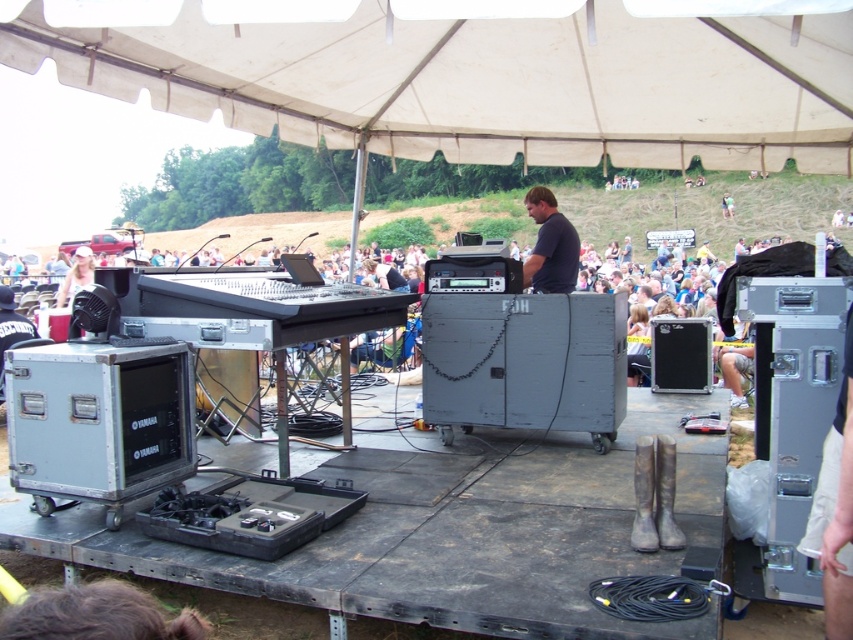
Can you confirm if white fabric canopy at upper center is wider than matte white baseball cap at upper left?

No.

Is point (722, 58) in front of point (71, 296)?

That is True.

Image resolution: width=853 pixels, height=640 pixels. I want to click on white fabric canopy at upper center, so click(x=486, y=83).

How distant is white fabric canopy at upper center from dark gray shirt at center?

white fabric canopy at upper center and dark gray shirt at center are 1.69 meters apart.

Describe the element at coordinates (486, 83) in the screenshot. I see `white fabric canopy at upper center` at that location.

Consider the image. Who is more distant from viewer, (380,10) or (553,224)?

The point (553,224) is behind.

You are a GUI agent. You are given a task and a screenshot of the screen. Output one action in this format:
    pyautogui.click(x=<x>, y=<y>)
    Task: Click on the white fabric canopy at upper center
    This screenshot has width=853, height=640.
    Given the screenshot: What is the action you would take?
    pyautogui.click(x=486, y=83)

From the picture: Does dark gray shirt at center have a lesser height compared to matte white baseball cap at upper left?

Yes.

Is dark gray shirt at center to the left of matte white baseball cap at upper left from the viewer's perspective?

In fact, dark gray shirt at center is to the right of matte white baseball cap at upper left.

Locate an element on the screen. The width and height of the screenshot is (853, 640). dark gray shirt at center is located at coordinates (550, 244).